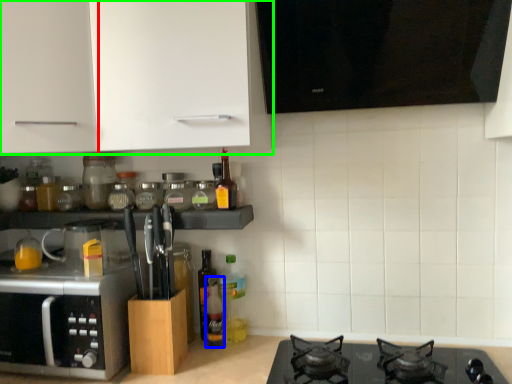
Question: Which object is the closest to the cabinetry (highlighted by a red box)? Choose among these: bottle (highlighted by a blue box) or cabinetry (highlighted by a green box).

Choices:
 (A) bottle
 (B) cabinetry

Answer: (B)